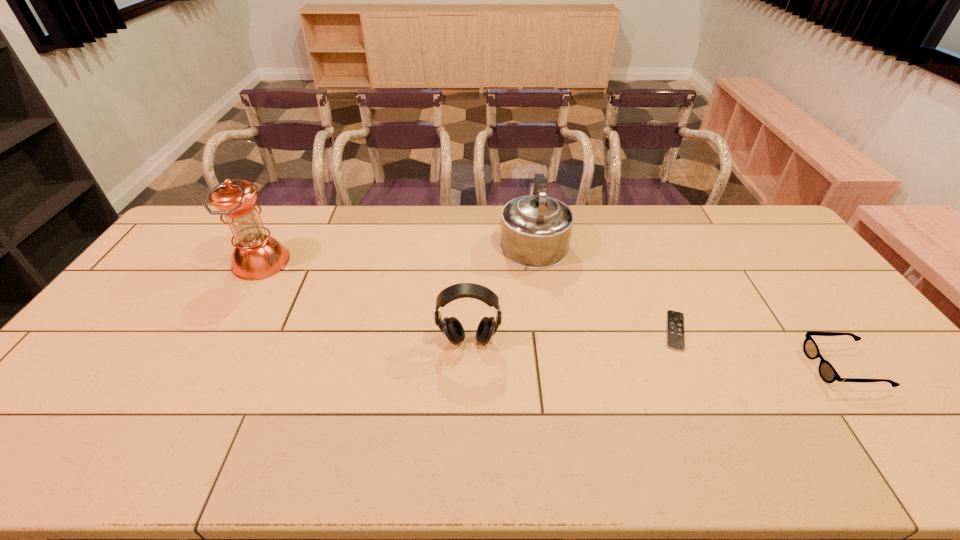
Image resolution: width=960 pixels, height=540 pixels. Find the location of `the leftmost object`. the leftmost object is located at coordinates (257, 255).

Identify the location of the tallest object. This screenshot has width=960, height=540. (257, 255).

Where is `kettle`? kettle is located at coordinates (535, 230).

The image size is (960, 540). I want to click on the third object from left to right, so click(x=535, y=230).

I want to click on the third shortest object, so click(451, 327).

I want to click on earphone, so click(451, 327).

You are a GUI agent. You are given a task and a screenshot of the screen. Output one action in this format:
    pyautogui.click(x=<x>, y=<y>)
    Task: Click on the spectacles
    The height and width of the screenshot is (540, 960).
    Given the screenshot: What is the action you would take?
    pyautogui.click(x=828, y=374)

Where is `the fourth tallest object`? The image size is (960, 540). the fourth tallest object is located at coordinates (828, 374).

This screenshot has height=540, width=960. In order to click on remote control in this screenshot , I will do `click(675, 320)`.

Where is `the shortest object`? Image resolution: width=960 pixels, height=540 pixels. the shortest object is located at coordinates (675, 320).